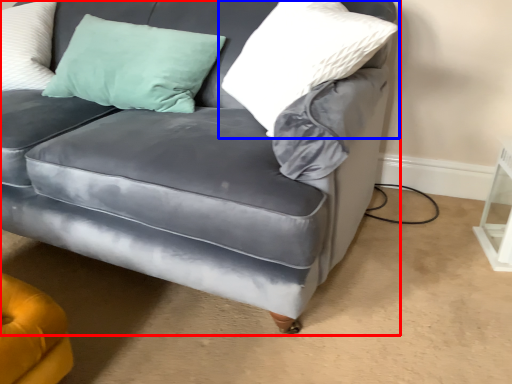
Question: Which point is further to the camera, studio couch (highlighted by a red box) or pillow (highlighted by a blue box)?

Choices:
 (A) studio couch
 (B) pillow

Answer: (B)